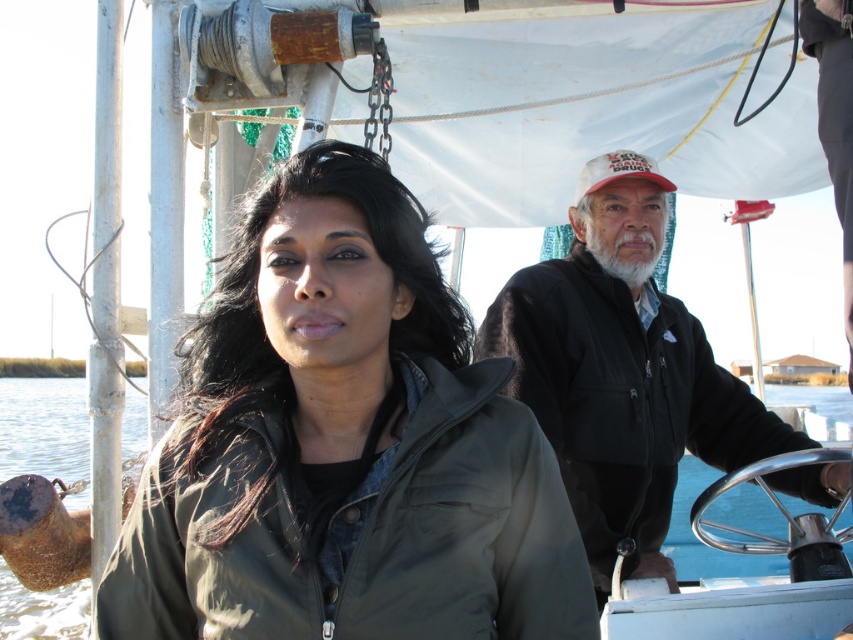
Question: Based on their relative distances, which object is farther from the clear blue water at center?

Choices:
 (A) black fleece jacket at center
 (B) green matte jacket at center

Answer: (A)

Question: Is green matte jacket at center thinner than black fleece jacket at center?

Choices:
 (A) yes
 (B) no

Answer: (A)

Question: Which object appears farthest from the camera in this image?

Choices:
 (A) clear blue water at center
 (B) green matte jacket at center
 (C) black fleece jacket at center

Answer: (A)

Question: Which object is the closest to the black fleece jacket at center?

Choices:
 (A) clear blue water at center
 (B) green matte jacket at center

Answer: (B)

Question: Is black fleece jacket at center further to the viewer compared to clear blue water at center?

Choices:
 (A) no
 (B) yes

Answer: (A)

Question: Can you confirm if green matte jacket at center is positioned above black fleece jacket at center?

Choices:
 (A) no
 (B) yes

Answer: (A)